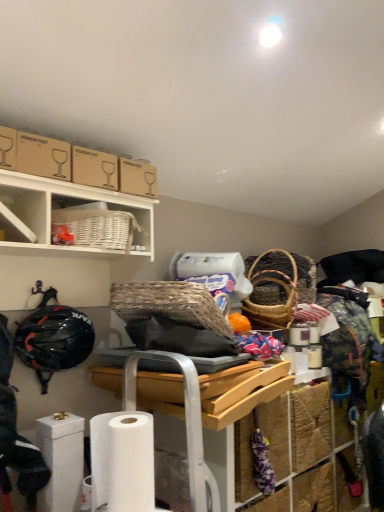
What do you see at coordinates (43, 156) in the screenshot? This screenshot has height=512, width=384. I see `brown cardboard box at upper left` at bounding box center [43, 156].

Image resolution: width=384 pixels, height=512 pixels. What are the coordinates of `white matte cabinet at upper left` in the screenshot? It's located at (23, 214).

Is point (14, 168) positioned behind point (44, 221)?

No, it is in front of (44, 221).

Looking at this image, considering the relative positions of matte cardboard box at upper left and white matte cabinet at upper left in the image provided, is matte cardboard box at upper left to the left of white matte cabinet at upper left from the viewer's perspective?

Correct, you'll find matte cardboard box at upper left to the left of white matte cabinet at upper left.

Would you consider matte cardboard box at upper left to be distant from white matte cabinet at upper left?

matte cardboard box at upper left is near white matte cabinet at upper left, not far away.

Is matte cardboard box at upper left aimed at white matte cabinet at upper left?

No, matte cardboard box at upper left is not aimed at white matte cabinet at upper left.

Can you confirm if white matte toilet paper at lower left, placed as the 2th toilet paper when sorted from front to back, is positioned to the left of matte cardboard box at upper left?

In fact, white matte toilet paper at lower left, placed as the 2th toilet paper when sorted from front to back, is to the right of matte cardboard box at upper left.

Considering the positions of objects white matte toilet paper at lower left, placed as the 2th toilet paper when sorted from front to back, and matte cardboard box at upper left in the image provided, who is behind, white matte toilet paper at lower left, placed as the 2th toilet paper when sorted from front to back, or matte cardboard box at upper left?

white matte toilet paper at lower left, placed as the 2th toilet paper when sorted from front to back, is further away from the camera.

There is a matte cardboard box at upper left. Where is `the 2nd toilet paper below it (from the image's perspective)`? The height and width of the screenshot is (512, 384). the 2nd toilet paper below it (from the image's perspective) is located at coordinates (61, 461).

Visually, is white matte cabinet at upper left positioned to the left or to the right of matte cardboard box at upper left?

Answer: Clearly, white matte cabinet at upper left is on the right of matte cardboard box at upper left in the image.

Does point (19, 215) come in front of point (10, 152)?

No, it is behind (10, 152).

From the picture: Is white matte cabinet at upper left not near matte cardboard box at upper left?

No, white matte cabinet at upper left is not far away from matte cardboard box at upper left.

From the image's perspective, does white matte cabinet at upper left appear lower than matte cardboard box at upper left?

Correct, white matte cabinet at upper left appears lower than matte cardboard box at upper left in the image.

Does matte cardboard box at upper left have a lesser width compared to wooden tray at center?

Indeed, matte cardboard box at upper left has a lesser width compared to wooden tray at center.

Is matte cardboard box at upper left spatially inside wooden tray at center, or outside of it?

The correct answer is: outside.

Which is in front, matte cardboard box at upper left or wooden tray at center?

matte cardboard box at upper left.

At what (x,y) coordinates should I click in order to perform the action: click on table behind the matte cardboard box at upper left. Please return your answer as a coordinate pair (x, y). Looking at the image, I should click on (188, 396).

Measure the distance from wooden tray at center to white matte toilet paper at lower left, placed as the second toilet paper when sorted from right to left.

wooden tray at center is 12.98 inches away from white matte toilet paper at lower left, placed as the second toilet paper when sorted from right to left.

Is wooden tray at center inside or outside of white matte toilet paper at lower left, placed as the second toilet paper when sorted from right to left?

wooden tray at center is located beyond the bounds of white matte toilet paper at lower left, placed as the second toilet paper when sorted from right to left.

Considering the positions of points (143, 375) and (65, 466), is point (143, 375) farther from camera compared to point (65, 466)?

Yes, point (143, 375) is behind point (65, 466).

Could you tell me if wooden tray at center is facing white matte toilet paper at lower left, placed as the second toilet paper when sorted from right to left?

No, wooden tray at center is not turned towards white matte toilet paper at lower left, placed as the second toilet paper when sorted from right to left.

Is point (67, 207) closer or farther from the camera than point (58, 256)?

Point (67, 207) is positioned closer to the camera compared to point (58, 256).

From a real-world perspective, which is physically below, white wicker basket at upper center, which ranks as the first shelf in right-to-left order, or white wicker basket at upper left, positioned as the 2th shelf in right-to-left order?

white wicker basket at upper left, positioned as the 2th shelf in right-to-left order.

Where is `shelf positioned vertically above the white wicker basket at upper left, positioned as the 2th shelf in right-to-left order (from a real-world perspective)`? This screenshot has width=384, height=512. shelf positioned vertically above the white wicker basket at upper left, positioned as the 2th shelf in right-to-left order (from a real-world perspective) is located at coordinates (107, 223).

Is point (126, 451) closer or farther from the camera than point (58, 430)?

Point (126, 451).

From a real-world perspective, is white matte toilet paper at lower left, arranged as the second toilet paper when viewed from the left, located higher than white matte toilet paper at lower left, placed as the second toilet paper when sorted from right to left?

Yes, from a real-world perspective, white matte toilet paper at lower left, arranged as the second toilet paper when viewed from the left, is above white matte toilet paper at lower left, placed as the second toilet paper when sorted from right to left.

From the picture: From the image's perspective, which is below, white matte toilet paper at lower left, the 1th toilet paper positioned from the front, or white matte toilet paper at lower left, the first toilet paper in the back-to-front sequence?

From the image's view, white matte toilet paper at lower left, the first toilet paper in the back-to-front sequence, is below.

At what (x,y) coordinates should I click in order to perform the action: click on cabinet behind the matte cardboard box at upper left. Please return your answer as a coordinate pair (x, y). The image size is (384, 512). Looking at the image, I should click on (23, 214).

There is a matte cardboard box at upper left. Identify the location of the 2nd toilet paper below it (from a real-world perspective). The width and height of the screenshot is (384, 512). pos(61,461).

When comparing their distances from matte cardboard box at upper left, does brown cardboard box at upper left or white matte toilet paper at lower left, placed as the 2th toilet paper when sorted from front to back, seem further?

The object further to matte cardboard box at upper left is white matte toilet paper at lower left, placed as the 2th toilet paper when sorted from front to back.

Looking at the image, which one is located closer to white matte toilet paper at lower left, the second toilet paper positioned from the back, brown cardboard box at upper left or white wicker basket at upper center, which ranks as the first shelf in right-to-left order?

white wicker basket at upper center, which ranks as the first shelf in right-to-left order.

Looking at the image, which one is located closer to wooden tray at center, white wicker basket at upper left, which ranks as the 1th shelf in left-to-right order, or white matte toilet paper at lower left, which is the first toilet paper in right-to-left order?

white matte toilet paper at lower left, which is the first toilet paper in right-to-left order, lies closer to wooden tray at center than the other object.

Consider the image. From the image, which object appears to be farther from wooden tray at center, white matte toilet paper at lower left, the second toilet paper positioned from the back, or white matte toilet paper at lower left, the first toilet paper in the back-to-front sequence?

white matte toilet paper at lower left, the first toilet paper in the back-to-front sequence.

Consider the image. Looking at the image, which one is located further to matte cardboard box at upper left, wooden tray at center or white wicker basket at upper left, positioned as the 2th shelf in right-to-left order?

wooden tray at center is further to matte cardboard box at upper left.

Estimate the real-world distances between objects in this image. Which object is further from white matte toilet paper at lower left, the 1th toilet paper positioned from the front, white wicker basket at upper center, which ranks as the first shelf in right-to-left order, or black matte helmet at left?

white wicker basket at upper center, which ranks as the first shelf in right-to-left order.

Considering their positions, is white matte toilet paper at lower left, arranged as the second toilet paper when viewed from the left, positioned closer to black matte helmet at left than white matte cabinet at upper left?

white matte cabinet at upper left lies closer to black matte helmet at left than the other object.

When comparing their distances from white matte toilet paper at lower left, marked as the first toilet paper in a left-to-right arrangement, does white matte toilet paper at lower left, which is the first toilet paper in right-to-left order, or brown cardboard box at upper left seem further?

Among the two, brown cardboard box at upper left is located further to white matte toilet paper at lower left, marked as the first toilet paper in a left-to-right arrangement.

Find the location of a particular element. This screenshot has height=512, width=384. table between matte cardboard box at upper left and white matte toilet paper at lower left, arranged as the second toilet paper when viewed from the left, in the vertical direction is located at coordinates (188, 396).

At what (x,y) coordinates should I click in order to perform the action: click on table that lies between white wicker basket at upper left, positioned as the 2th shelf in right-to-left order, and white matte toilet paper at lower left, arranged as the second toilet paper when viewed from the left, from top to bottom. Please return your answer as a coordinate pair (x, y). Looking at the image, I should click on (188, 396).

At what (x,y) coordinates should I click in order to perform the action: click on cabinet between brown cardboard box at upper left and black matte helmet at left in the up-down direction. Please return your answer as a coordinate pair (x, y). This screenshot has height=512, width=384. Looking at the image, I should click on pyautogui.click(x=23, y=214).

This screenshot has height=512, width=384. I want to click on toilet paper between white matte toilet paper at lower left, marked as the first toilet paper in a left-to-right arrangement, and wooden tray at center, so click(x=122, y=461).